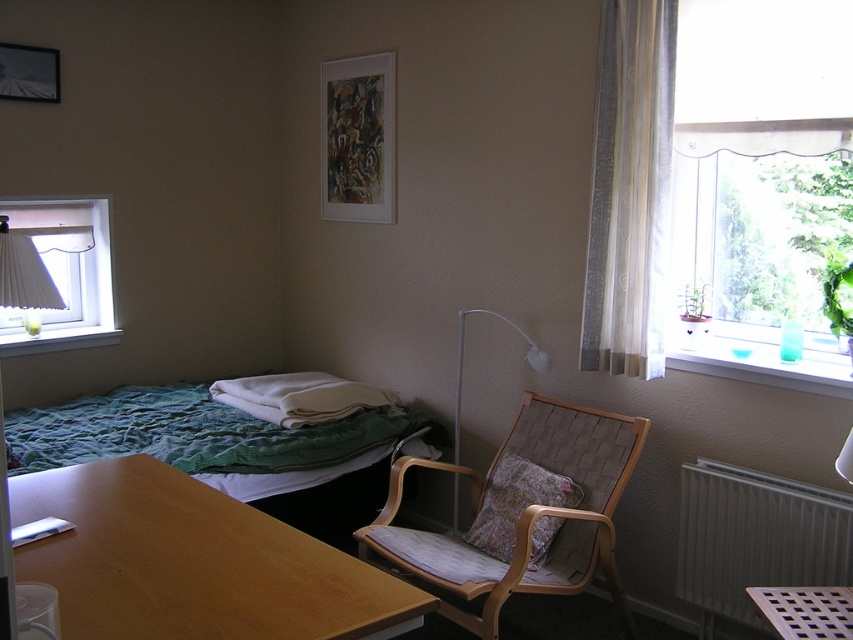
Question: Can you confirm if white pleated curtain at left is positioned to the right of white glossy floor lamp at center?

Choices:
 (A) no
 (B) yes

Answer: (A)

Question: Is sheer white curtain at upper right to the left of white pleated curtain at left from the viewer's perspective?

Choices:
 (A) yes
 (B) no

Answer: (B)

Question: Is transparent glass window at upper right smaller than white plastic radiator at lower right?

Choices:
 (A) no
 (B) yes

Answer: (A)

Question: Based on their relative distances, which object is farther from the sheer white curtain at upper right?

Choices:
 (A) wooden table at lower left
 (B) white plastic radiator at lower right
 (C) white pleated curtain at left
 (D) floral fabric pillow at center

Answer: (C)

Question: Which of these objects is positioned farthest from the sheer white curtain at upper right?

Choices:
 (A) wooden table at lower left
 (B) transparent glass window at upper right

Answer: (A)

Question: Which point is closer to the camera?

Choices:
 (A) (540, 534)
 (B) (700, 461)
 (C) (53, 205)
 (D) (103, 435)

Answer: (A)